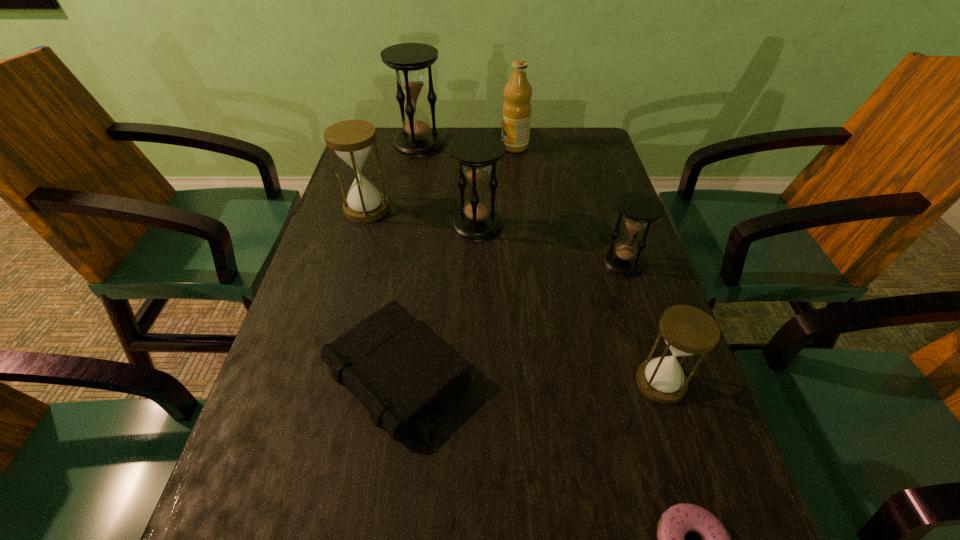
Find the location of `vacant space situated on the right of the seventh tallest object`. vacant space situated on the right of the seventh tallest object is located at coordinates (588, 373).

You are a GUI agent. You are given a task and a screenshot of the screen. Output one action in this format:
    pyautogui.click(x=<x>, y=<y>)
    Task: Click on the hourglass that is positioned at the far edge
    The image size is (960, 540).
    Given the screenshot: What is the action you would take?
    pyautogui.click(x=417, y=139)

The width and height of the screenshot is (960, 540). What are the coordinates of `olive oil that is at the far edge` in the screenshot? It's located at (x=516, y=114).

Locate an element on the screen. Bible present at the left edge is located at coordinates (400, 371).

Identify the location of object that is positioned at the far left corner. The height and width of the screenshot is (540, 960). (417, 139).

At what (x,y) coordinates should I click in order to perform the action: click on vacant space at the far edge of the desktop. Please return your answer as a coordinate pair (x, y). This screenshot has height=540, width=960. Looking at the image, I should click on (448, 143).

You are a GUI agent. You are given a task and a screenshot of the screen. Output one action in this format:
    pyautogui.click(x=<x>, y=<y>)
    Task: Click on the vacant area at the left edge
    The height and width of the screenshot is (540, 960).
    Given the screenshot: What is the action you would take?
    pyautogui.click(x=355, y=253)

In order to click on vacant space at the right edge in this screenshot , I will do `click(601, 195)`.

In the image, there is a desktop. Where is `vacant space at the far left corner`? This screenshot has height=540, width=960. vacant space at the far left corner is located at coordinates (384, 136).

The height and width of the screenshot is (540, 960). In the image, there is a desktop. In order to click on vacant space at the far right corner in this screenshot , I will do `click(561, 139)`.